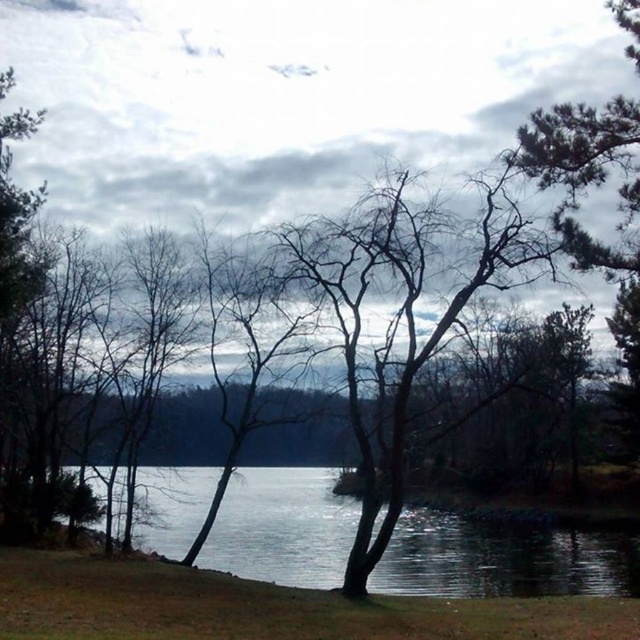
Question: Among these objects, which one is farthest from the camera?

Choices:
 (A) bare branches at center
 (B) transparent water at center

Answer: (A)

Question: Which point is farther to the camera?

Choices:
 (A) transparent water at center
 (B) bare branches at center

Answer: (B)

Question: From the image, what is the correct spatial relationship of transparent water at center in relation to bare branches at center?

Choices:
 (A) left
 (B) right

Answer: (B)

Question: Considering the relative positions of transparent water at center and bare branches at center in the image provided, where is transparent water at center located with respect to bare branches at center?

Choices:
 (A) above
 (B) below

Answer: (B)

Question: Does transparent water at center have a greater width compared to bare branches at center?

Choices:
 (A) yes
 (B) no

Answer: (A)